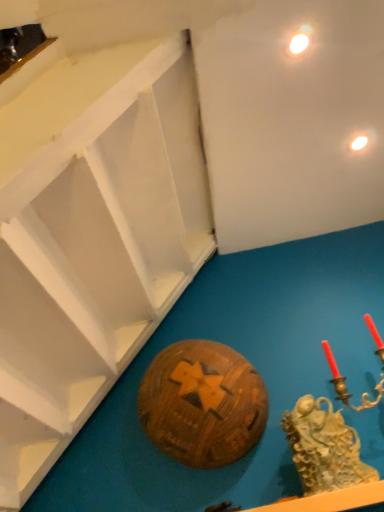
Describe the element at coordinates (299, 41) in the screenshot. I see `matte white light at upper right, the 1th light when ordered from top to bottom` at that location.

I want to click on wooden ball at center, so click(202, 404).

At what (x,y) coordinates should I click in order to perform the action: click on matte white light at upper right, the 2th light from the front. Please return your answer as a coordinate pair (x, y). The width and height of the screenshot is (384, 512). Looking at the image, I should click on coord(359,143).

What is the approximate height of matte white light at upper right, which is counted as the first light, starting from the bottom?

matte white light at upper right, which is counted as the first light, starting from the bottom, is 0.88 inches in height.

You are a GUI agent. You are given a task and a screenshot of the screen. Output one action in this format:
    pyautogui.click(x=<x>, y=<y>)
    Task: Click on the matte white light at upper right, positioned as the second light in right-to-left order
    
    Given the screenshot: What is the action you would take?
    pyautogui.click(x=299, y=41)

From a real-world perspective, relative to gold textured sculpture at lower right, is matte white light at upper right, the second light when ordered from back to front, vertically above or below?

matte white light at upper right, the second light when ordered from back to front, is above gold textured sculpture at lower right.

Does matte white light at upper right, which is counted as the first light, starting from the left, turn towards gold textured sculpture at lower right?

No.

I want to click on type that is behind the matte white light at upper right, which is counted as the first light, starting from the left, so click(324, 447).

Considering the relative sizes of gold textured sculpture at lower right and matte white light at upper right, which is counted as the first light, starting from the bottom, in the image provided, is gold textured sculpture at lower right wider than matte white light at upper right, which is counted as the first light, starting from the bottom,?

Correct, the width of gold textured sculpture at lower right exceeds that of matte white light at upper right, which is counted as the first light, starting from the bottom.

From the image's perspective, count 1st lights upward from the gold textured sculpture at lower right and point to it. Please provide its 2D coordinates.

[(359, 143)]

Is gold textured sculpture at lower right far away from matte white light at upper right, which is the second light from left to right?

Yes, gold textured sculpture at lower right is far from matte white light at upper right, which is the second light from left to right.

Which point is more distant from viewer, (374, 480) or (362, 140)?

The point (362, 140) is more distant.

Can you see matte white light at upper right, which is the 1th light from front to back, touching matte white light at upper right, acting as the 1th light starting from the back?

No, matte white light at upper right, which is the 1th light from front to back, is not next to matte white light at upper right, acting as the 1th light starting from the back.

Is point (298, 40) positioned before point (365, 136)?

That is True.

From the image's perspective, does matte white light at upper right, which is the 1th light from front to back, appear lower than matte white light at upper right, which is counted as the first light, starting from the bottom?

No.

Is matte white light at upper right, the 2th light from the front, facing towards wooden ball at center?

No.

Looking at this image, is matte white light at upper right, the second light when ordered from top to bottom, not within wooden ball at center?

matte white light at upper right, the second light when ordered from top to bottom, lies outside wooden ball at center's area.

Relative to wooden ball at center, is matte white light at upper right, which is the second light from left to right, in front or behind?

Clearly, matte white light at upper right, which is the second light from left to right, is behind wooden ball at center.

Is matte white light at upper right, which is the second light from left to right, bigger or smaller than wooden ball at center?

In the image, matte white light at upper right, which is the second light from left to right, appears to be smaller than wooden ball at center.

Are wooden ball at center and gold textured sculpture at lower right making contact?

No, wooden ball at center is not in contact with gold textured sculpture at lower right.

Is wooden ball at center outside of gold textured sculpture at lower right?

Indeed, wooden ball at center is completely outside gold textured sculpture at lower right.

From the image's perspective, is wooden ball at center on gold textured sculpture at lower right?

Correct, wooden ball at center appears higher than gold textured sculpture at lower right in the image.

From a real-world perspective, is wooden ball at center on gold textured sculpture at lower right?

Yes, from a real-world perspective, wooden ball at center is above gold textured sculpture at lower right.

Considering the sizes of objects matte white light at upper right, arranged as the 1th light when viewed from the right, and gold textured sculpture at lower right in the image provided, who is shorter, matte white light at upper right, arranged as the 1th light when viewed from the right, or gold textured sculpture at lower right?

matte white light at upper right, arranged as the 1th light when viewed from the right.

Between point (365, 139) and point (345, 440), which one is positioned in front?

The point (345, 440) is closer.

Between matte white light at upper right, which is the second light from left to right, and gold textured sculpture at lower right, which one appears on the right side from the viewer's perspective?

matte white light at upper right, which is the second light from left to right.

From a real-world perspective, between matte white light at upper right, the 2th light from the front, and gold textured sculpture at lower right, who is vertically higher?

From a 3D spatial view, matte white light at upper right, the 2th light from the front, is above.

Considering the relative sizes of gold textured sculpture at lower right and wooden ball at center in the image provided, is gold textured sculpture at lower right shorter than wooden ball at center?

Yes, gold textured sculpture at lower right is shorter than wooden ball at center.

From a real-world perspective, is gold textured sculpture at lower right below wooden ball at center?

Correct, in the physical world, gold textured sculpture at lower right is lower than wooden ball at center.

Does gold textured sculpture at lower right turn towards wooden ball at center?

No, gold textured sculpture at lower right is not oriented towards wooden ball at center.

Which is less distant, (351, 474) or (164, 437)?

Point (351, 474) appears to be closer to the viewer than point (164, 437).

This screenshot has height=512, width=384. I want to click on type that appears on the right of matte white light at upper right, the second light when ordered from back to front, so click(324, 447).

The height and width of the screenshot is (512, 384). What are the coordinates of `type in front of the matte white light at upper right, acting as the 1th light starting from the back` in the screenshot? It's located at (324, 447).

Which object lies nearer to the anchor point gold textured sculpture at lower right, matte white light at upper right, which is the second light from left to right, or matte white light at upper right, marked as the second light in a bottom-to-top arrangement?

matte white light at upper right, which is the second light from left to right, is positioned closer to the anchor gold textured sculpture at lower right.

Based on the photo, which object lies further to the anchor point gold textured sculpture at lower right, matte white light at upper right, which is counted as the first light, starting from the left, or matte white light at upper right, which is the second light from left to right?

The object further to gold textured sculpture at lower right is matte white light at upper right, which is counted as the first light, starting from the left.

When comparing their distances from wooden ball at center, does matte white light at upper right, which is the second light from left to right, or matte white light at upper right, which is counted as the first light, starting from the left, seem closer?

matte white light at upper right, which is the second light from left to right.

Based on their spatial positions, is matte white light at upper right, arranged as the 1th light when viewed from the right, or wooden ball at center closer to gold textured sculpture at lower right?

Among the two, wooden ball at center is located nearer to gold textured sculpture at lower right.

Based on their spatial positions, is matte white light at upper right, marked as the second light in a bottom-to-top arrangement, or wooden ball at center further from matte white light at upper right, the 2th light from the front?

wooden ball at center is positioned further to the anchor matte white light at upper right, the 2th light from the front.

Considering their positions, is gold textured sculpture at lower right positioned closer to matte white light at upper right, marked as the second light in a bottom-to-top arrangement, than matte white light at upper right, the second light when ordered from top to bottom?

Among the two, matte white light at upper right, the second light when ordered from top to bottom, is located nearer to matte white light at upper right, marked as the second light in a bottom-to-top arrangement.

Considering their positions, is wooden ball at center positioned further to matte white light at upper right, the 1th light when ordered from top to bottom, than gold textured sculpture at lower right?

gold textured sculpture at lower right is positioned further to the anchor matte white light at upper right, the 1th light when ordered from top to bottom.

When comparing their distances from wooden ball at center, does gold textured sculpture at lower right or matte white light at upper right, the 1th light when ordered from top to bottom, seem further?

matte white light at upper right, the 1th light when ordered from top to bottom.

The height and width of the screenshot is (512, 384). What are the coordinates of `light between matte white light at upper right, the 1th light when ordered from top to bottom, and gold textured sculpture at lower right vertically` in the screenshot? It's located at (359, 143).

Where is `light between matte white light at upper right, marked as the second light in a bottom-to-top arrangement, and wooden ball at center vertically`? The height and width of the screenshot is (512, 384). light between matte white light at upper right, marked as the second light in a bottom-to-top arrangement, and wooden ball at center vertically is located at coordinates (359, 143).

You are a GUI agent. You are given a task and a screenshot of the screen. Output one action in this format:
    pyautogui.click(x=<x>, y=<y>)
    Task: Click on the ball between matte white light at upper right, which is counted as the first light, starting from the left, and gold textured sculpture at lower right vertically
    This screenshot has height=512, width=384.
    Given the screenshot: What is the action you would take?
    pyautogui.click(x=202, y=404)

At what (x,y) coordinates should I click in order to perform the action: click on ball between matte white light at upper right, arranged as the 1th light when viewed from the right, and gold textured sculpture at lower right in the up-down direction. Please return your answer as a coordinate pair (x, y). This screenshot has width=384, height=512. Looking at the image, I should click on (202, 404).